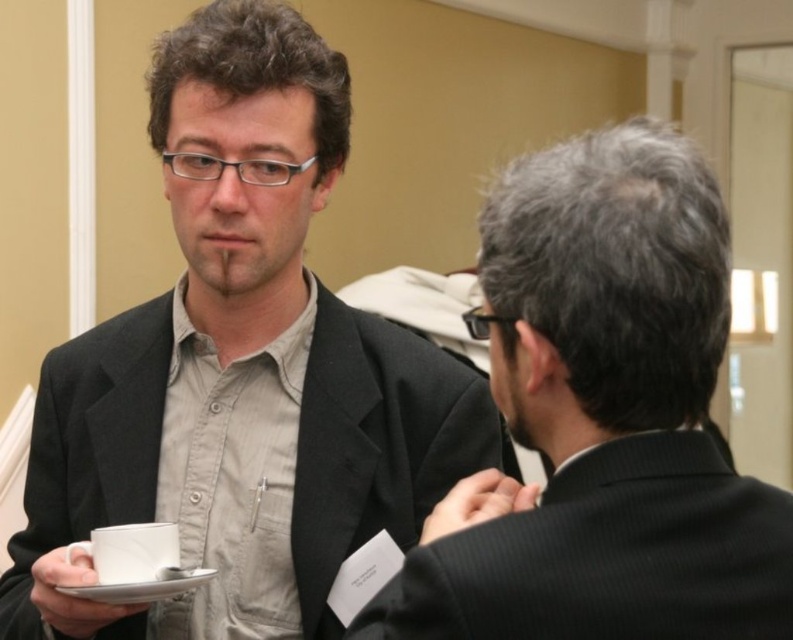
Can you confirm if white ceramic cup at lower left is smaller than white ceramic saucer at lower left?

Correct, white ceramic cup at lower left occupies less space than white ceramic saucer at lower left.

Based on the photo, does white ceramic cup at lower left have a greater height compared to white ceramic saucer at lower left?

Correct, white ceramic cup at lower left is much taller as white ceramic saucer at lower left.

Based on the photo, who is more forward, (121, 572) or (156, 595)?

Point (121, 572) is in front.

Identify the location of white ceramic cup at lower left. (132, 552).

Can you confirm if black pinstripe suit at right is taller than white ceramic cup at lower left?

Correct, black pinstripe suit at right is much taller as white ceramic cup at lower left.

Based on the photo, is black pinstripe suit at right bigger than white ceramic cup at lower left?

Yes, black pinstripe suit at right is bigger than white ceramic cup at lower left.

Who is more forward, (x=462, y=496) or (x=109, y=536)?

Point (x=462, y=496)

Locate an element on the screen. The image size is (793, 640). black pinstripe suit at right is located at coordinates point(600,419).

Is black pinstripe suit at right positioned at the back of white ceramic saucer at lower left?

No.

Who is lower down, black pinstripe suit at right or white ceramic saucer at lower left?

white ceramic saucer at lower left

In the scene shown: Measure the distance between point (493, 204) and camera.

Point (493, 204) is 32.14 inches away from camera.

The image size is (793, 640). I want to click on black pinstripe suit at right, so click(x=600, y=419).